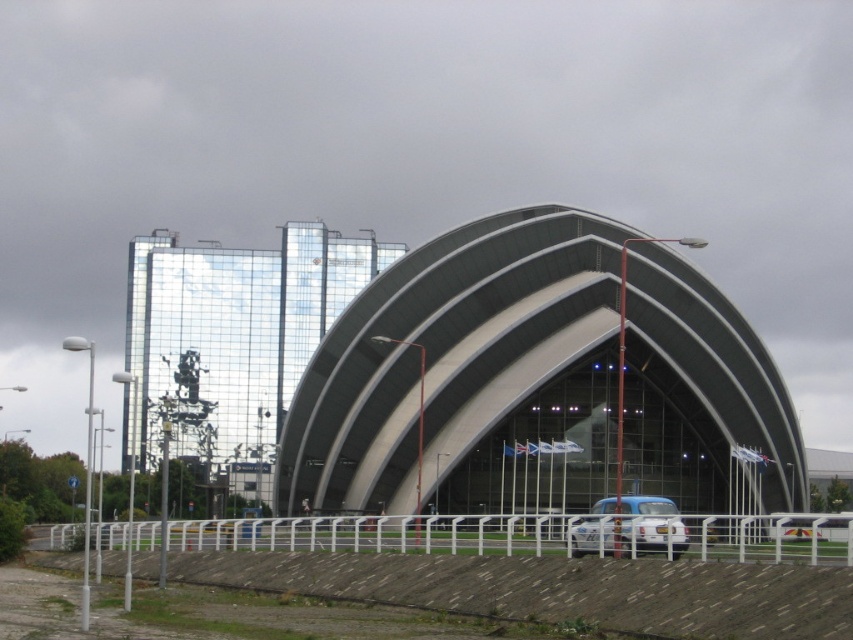
Is smooth glass dome at center to the right of blue matte car at center from the viewer's perspective?

Incorrect, smooth glass dome at center is not on the right side of blue matte car at center.

Does point (451, 433) come farther from viewer compared to point (605, 529)?

Yes, point (451, 433) is farther from viewer.

Where is `smooth glass dome at center`? The image size is (853, 640). smooth glass dome at center is located at coordinates point(457,364).

Find the location of `smooth glass dome at center`. smooth glass dome at center is located at coordinates (457, 364).

Describe the element at coordinates (233, 333) in the screenshot. I see `reflective glass building at center` at that location.

From the picture: Can you confirm if reflective glass building at center is thinner than blue matte car at center?

No.

Describe the element at coordinates (233, 333) in the screenshot. I see `reflective glass building at center` at that location.

This screenshot has width=853, height=640. Identify the location of reflective glass building at center. (233, 333).

Locate an element on the screen. Image resolution: width=853 pixels, height=640 pixels. smooth glass dome at center is located at coordinates (457, 364).

Who is more distant from viewer, (801, 486) or (183, 452)?

Point (183, 452)

Between point (691, 317) and point (152, 406), which one is positioned behind?

The point (152, 406) is behind.

You are a GUI agent. You are given a task and a screenshot of the screen. Output one action in this format:
    pyautogui.click(x=<x>, y=<y>)
    Task: Click on the smooth glass dome at center
    This screenshot has height=640, width=853.
    Given the screenshot: What is the action you would take?
    pyautogui.click(x=457, y=364)